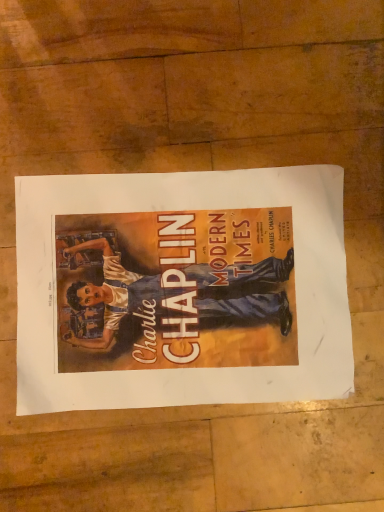
Find the location of a particular element. The width and height of the screenshot is (384, 512). free space above matte paper poster at center (from a real-world perspective) is located at coordinates (188, 284).